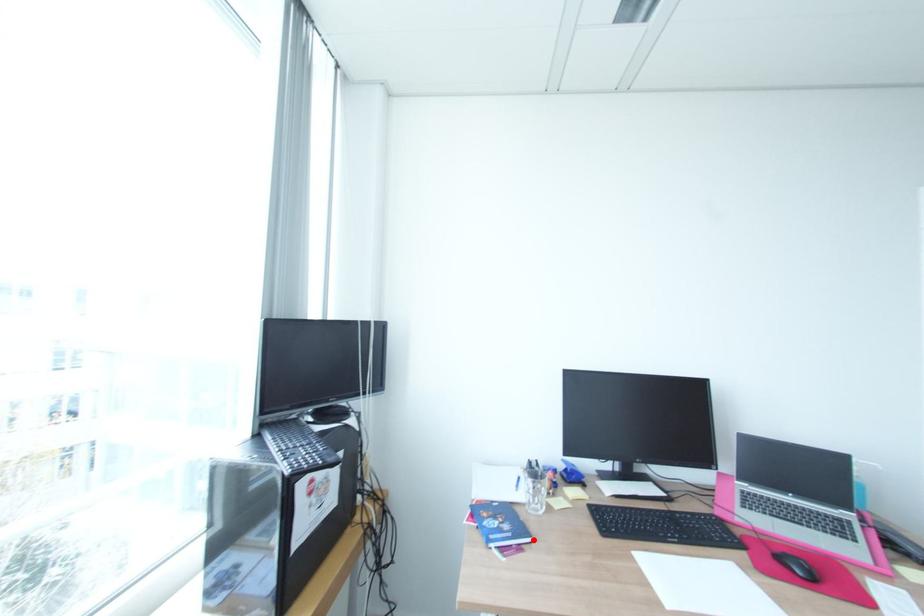
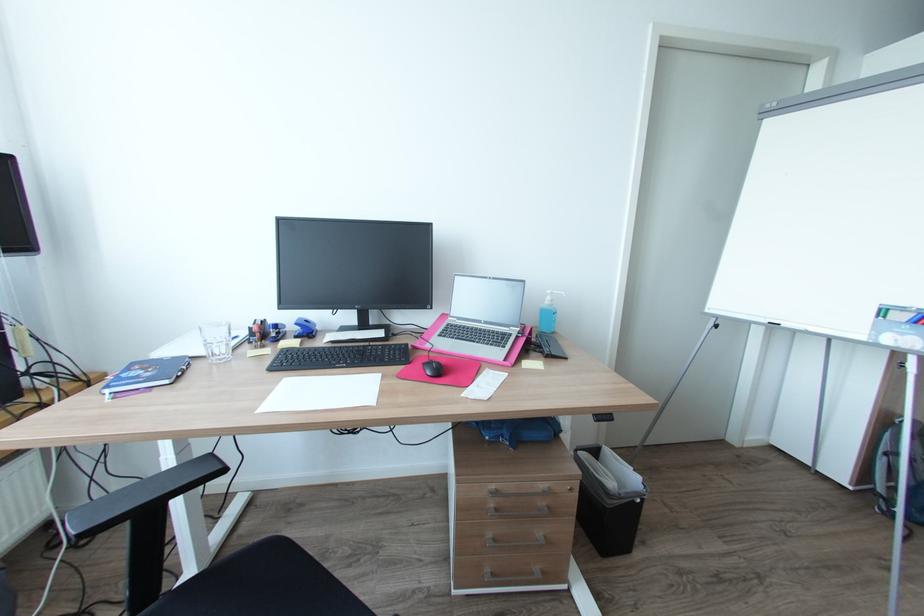
The point at the highlighted location is marked in the first image. Where is the corresponding point in the second image?

(171, 381)